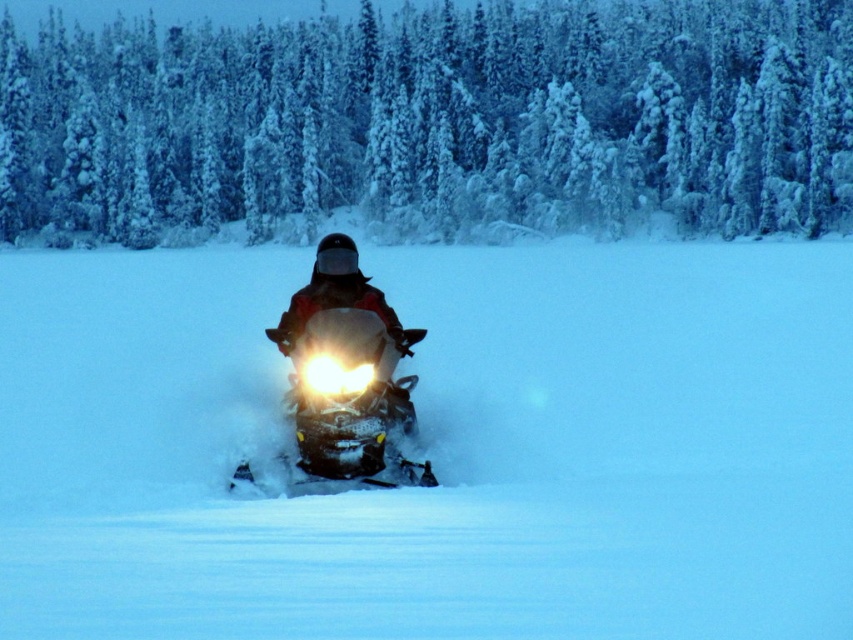
Question: Estimate the real-world distances between objects in this image. Which object is closer to the red jacket at center?

Choices:
 (A) shiny metallic snowmobile at center
 (B) bright white plastic headlight at center
 (C) white powdery snow at center

Answer: (A)

Question: Can you confirm if white powdery snow at center is bigger than bright white plastic headlight at center?

Choices:
 (A) no
 (B) yes

Answer: (B)

Question: Which point is closer to the camera taking this photo?

Choices:
 (A) (392, 353)
 (B) (381, 412)

Answer: (B)

Question: Which of these objects is positioned closest to the red jacket at center?

Choices:
 (A) shiny metallic snowmobile at center
 (B) bright white plastic headlight at center

Answer: (A)

Question: Can you confirm if white powdery snow at center is wider than red jacket at center?

Choices:
 (A) no
 (B) yes

Answer: (B)

Question: Is white powdery snow at center bigger than bright white plastic headlight at center?

Choices:
 (A) yes
 (B) no

Answer: (A)